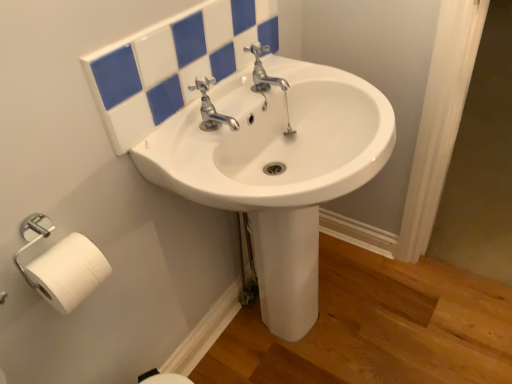
Question: Considering the relative sizes of white glossy mirror at upper center and chrome metallic faucet at center in the image provided, is white glossy mirror at upper center taller than chrome metallic faucet at center?

Choices:
 (A) yes
 (B) no

Answer: (A)

Question: Is white glossy mirror at upper center at the left side of chrome metallic faucet at center?

Choices:
 (A) no
 (B) yes

Answer: (B)

Question: Is chrome metallic faucet at center a part of white glossy mirror at upper center?

Choices:
 (A) yes
 (B) no

Answer: (B)

Question: From the image's perspective, would you say white glossy mirror at upper center is positioned over chrome metallic faucet at center?

Choices:
 (A) yes
 (B) no

Answer: (A)

Question: Is white glossy mirror at upper center aimed at chrome metallic faucet at center?

Choices:
 (A) yes
 (B) no

Answer: (A)

Question: From a real-world perspective, relative to white matte toilet paper at lower left, is chrome metallic faucet at center vertically above or below?

Choices:
 (A) below
 (B) above

Answer: (B)

Question: Is chrome metallic faucet at center spatially inside white matte toilet paper at lower left, or outside of it?

Choices:
 (A) inside
 (B) outside

Answer: (B)

Question: Considering the positions of chrome metallic faucet at center and white matte toilet paper at lower left in the image, is chrome metallic faucet at center wider or thinner than white matte toilet paper at lower left?

Choices:
 (A) thin
 (B) wide

Answer: (B)

Question: Is chrome metallic faucet at center taller or shorter than white matte toilet paper at lower left?

Choices:
 (A) tall
 (B) short

Answer: (B)

Question: Considering the positions of white glossy mirror at upper center and white matte toilet paper at lower left in the image, is white glossy mirror at upper center bigger or smaller than white matte toilet paper at lower left?

Choices:
 (A) big
 (B) small

Answer: (A)

Question: From the image's perspective, is white glossy mirror at upper center positioned above or below white matte toilet paper at lower left?

Choices:
 (A) below
 (B) above

Answer: (B)

Question: Based on their positions, is white glossy mirror at upper center located to the left or right of white matte toilet paper at lower left?

Choices:
 (A) right
 (B) left

Answer: (A)

Question: Is white glossy mirror at upper center in front of or behind white matte toilet paper at lower left in the image?

Choices:
 (A) behind
 (B) front

Answer: (A)

Question: In terms of width, does white glossy sink at center look wider or thinner when compared to white matte toilet paper at lower left?

Choices:
 (A) thin
 (B) wide

Answer: (B)

Question: Visually, is white glossy sink at center positioned to the left or to the right of white matte toilet paper at lower left?

Choices:
 (A) right
 (B) left

Answer: (A)